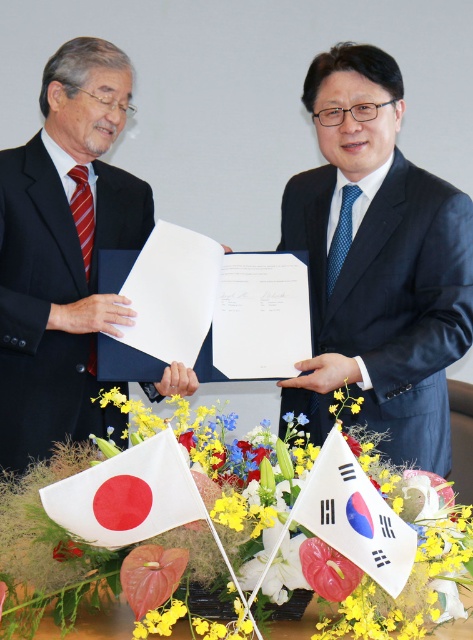
Question: Among these objects, which one is farthest from the camera?

Choices:
 (A) black satin suit at left
 (B) yellow fabric flower at center
 (C) white fabric flag at center
 (D) dark blue suit at center

Answer: (A)

Question: Which is farther from the white fabric flag at center?

Choices:
 (A) yellow fabric flower at center
 (B) black matte suit at center
 (C) black satin suit at left
 (D) dark blue suit at center

Answer: (C)

Question: Observing the image, what is the correct spatial positioning of dark blue suit at center in reference to white fabric flag at lower left?

Choices:
 (A) left
 (B) right

Answer: (B)

Question: Does black matte suit at center appear under dark blue suit at center?

Choices:
 (A) no
 (B) yes

Answer: (A)

Question: Which point is farther to the camera?

Choices:
 (A) white fabric flag at center
 (B) yellow fabric flower at center
 (C) white fabric flag at lower left

Answer: (C)

Question: Does black matte suit at center appear on the right side of dark blue suit at center?

Choices:
 (A) yes
 (B) no

Answer: (B)